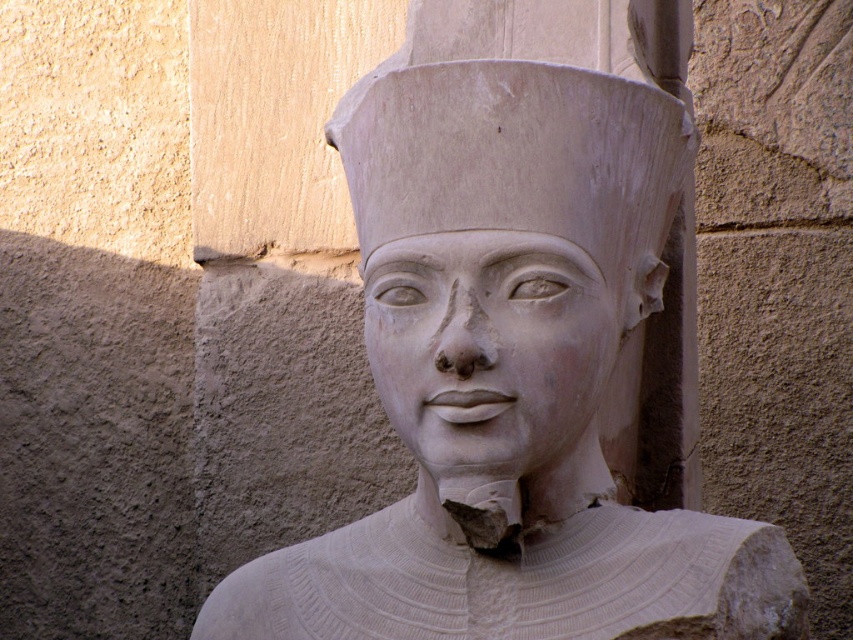
You are an art conservator examining the white stone statue at center and the white stone face at center in the image. Which object is positioned higher in the vertical axis?

The white stone statue at center is located above the white stone face at center, so the white stone statue at center is positioned higher in the vertical axis.

You are an art conservator examining the white stone statue at center and the white stone head at center. Which object is positioned closer to your viewpoint?

The white stone statue at center is closer to the viewer than the white stone head at center.

Based on the scene description, where is the white stone statue at center located in terms of its 2D coordinates?

The white stone statue at center is located at the 2D coordinates of point (527, 348).